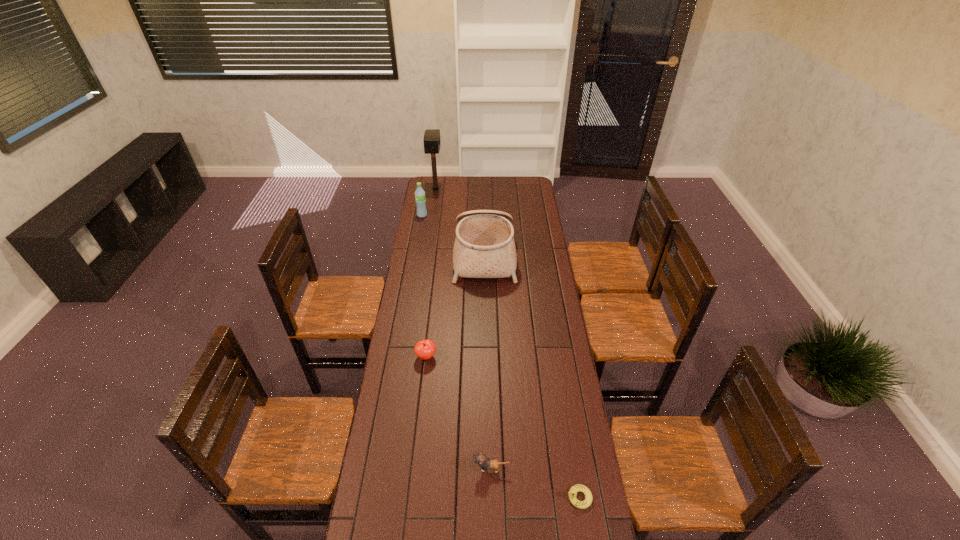
The width and height of the screenshot is (960, 540). Identify the location of the farthest object. (432, 142).

Identify the location of the tallest object. This screenshot has width=960, height=540. (432, 142).

You are a GUI agent. You are given a task and a screenshot of the screen. Output one action in this format:
    pyautogui.click(x=<x>, y=<y>)
    Task: Click on the third farthest object
    This screenshot has width=960, height=540.
    Given the screenshot: What is the action you would take?
    pyautogui.click(x=484, y=247)

You are a GUI agent. You are given a task and a screenshot of the screen. Output one action in this format:
    pyautogui.click(x=<x>, y=<y>)
    Task: Click on the water bottle
    
    Given the screenshot: What is the action you would take?
    pyautogui.click(x=420, y=199)

At what (x,y) coordinates should I click in order to perform the action: click on the second farthest object. Please return your answer as a coordinate pair (x, y). The height and width of the screenshot is (540, 960). Looking at the image, I should click on (420, 199).

This screenshot has width=960, height=540. Find the location of `apple`. apple is located at coordinates (425, 349).

The width and height of the screenshot is (960, 540). I want to click on the second nearest object, so click(481, 460).

Find the location of a particular element. the rightmost object is located at coordinates (574, 489).

Identify the location of the shortest object. This screenshot has width=960, height=540. (574, 489).

Identify the location of vacant region located 0.200m on the front of the tallest object. This screenshot has height=540, width=960. point(432,213).